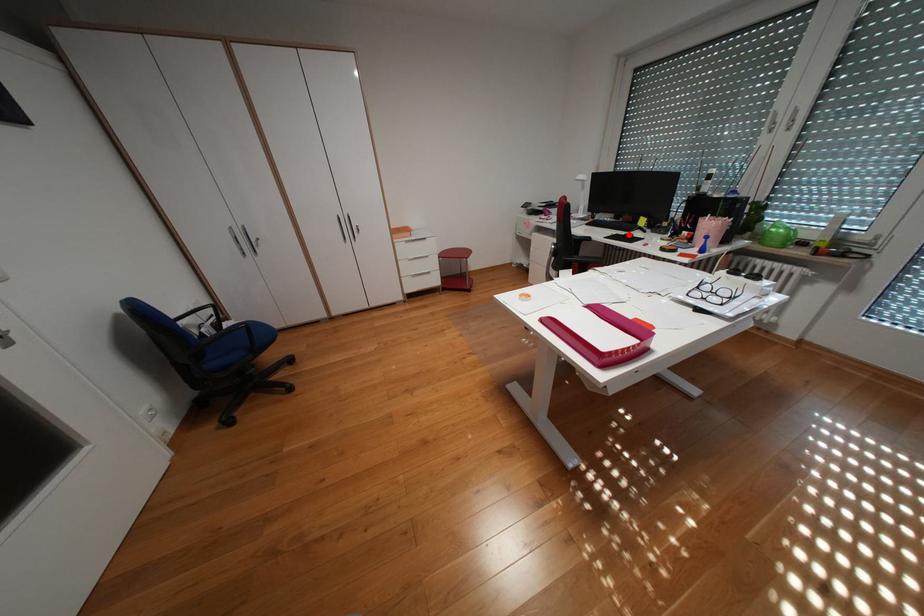
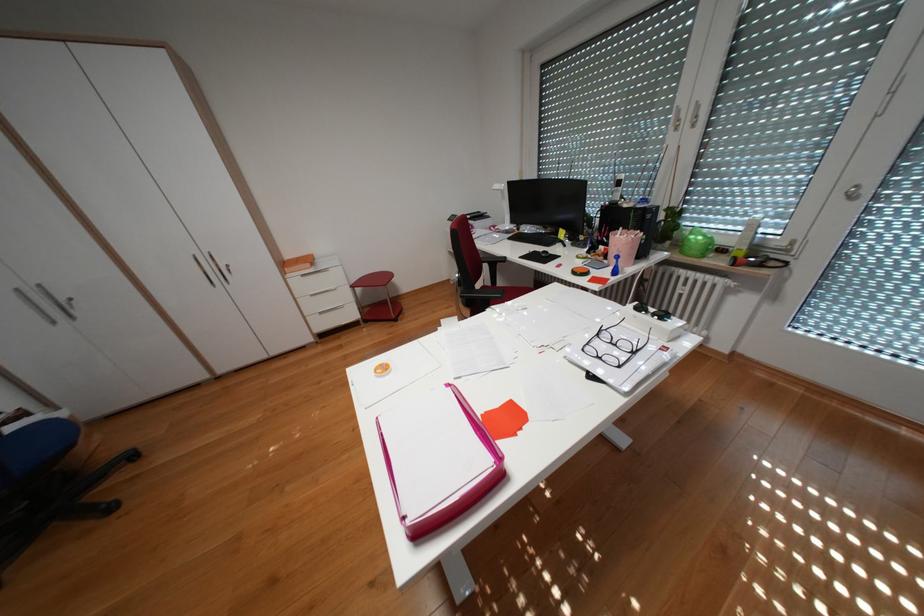
Locate, in the second image, the point that corresponds to the highlighted location in the first image.

(546, 252)